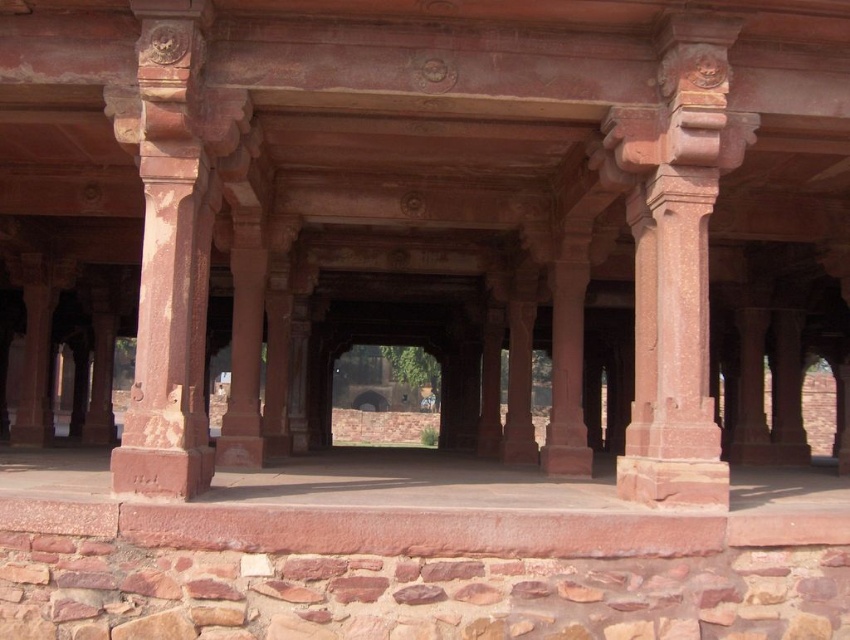
Question: Does rustic stone column at center have a larger size compared to rustic stone column at left?

Choices:
 (A) no
 (B) yes

Answer: (A)

Question: Which object is farther from the camera taking this photo?

Choices:
 (A) rustic stone column at left
 (B) rustic stone column at center

Answer: (B)

Question: Is rustic stone column at center to the right of rustic stone column at left from the viewer's perspective?

Choices:
 (A) no
 (B) yes

Answer: (B)

Question: Is rustic stone column at center smaller than rustic stone column at left?

Choices:
 (A) yes
 (B) no

Answer: (A)